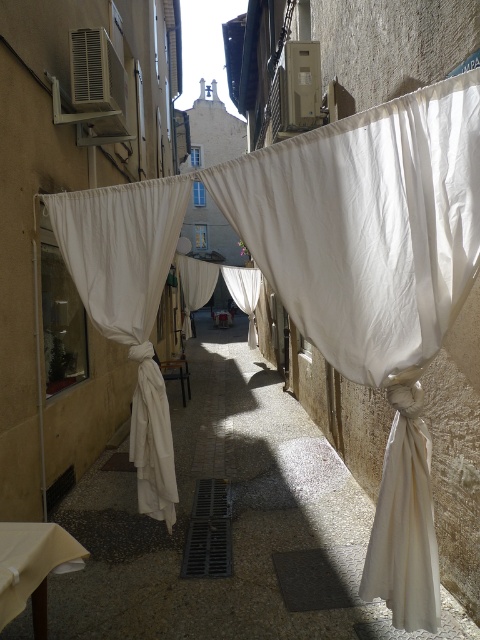
Question: Does white fabric at center appear under white cotton curtain at left?

Choices:
 (A) no
 (B) yes

Answer: (B)

Question: Which point is closer to the camera?

Choices:
 (A) white sheer curtain at center
 (B) white fabric at center

Answer: (B)

Question: Does white cotton curtain at left come in front of white sheer curtain at center?

Choices:
 (A) yes
 (B) no

Answer: (A)

Question: Which of these objects is positioned closest to the white sheer curtain at center?

Choices:
 (A) white cotton curtain at left
 (B) white fabric at center

Answer: (B)

Question: Is white cotton curtain at left in front of white sheer curtain at center?

Choices:
 (A) no
 (B) yes

Answer: (B)

Question: Among these points, which one is nearest to the camera?

Choices:
 (A) (253, 300)
 (B) (129, 292)
 (C) (118, 612)

Answer: (C)